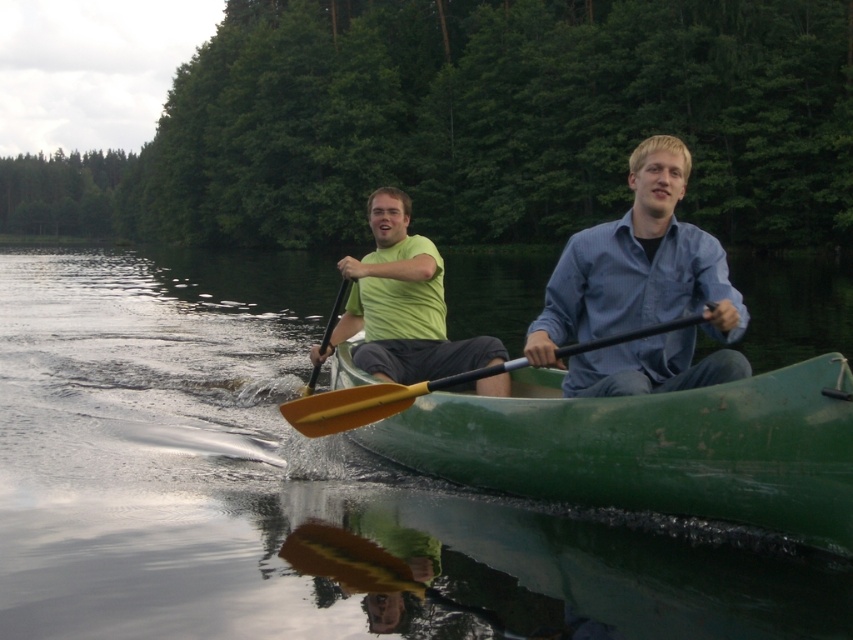
You are a photographer trying to capture the matte green shirt at center and the yellow wood paddle at center in the same frame. Can you see both items at the same time from your current position?

The yellow wood paddle at center is behind the matte green shirt at center, so you cannot see both items at the same time from your current position.

You are an observer standing on the lakeshore, looking at the green matte canoe at center and the matte green shirt at center. Which object appears taller from your viewpoint?

The matte green shirt at center appears taller than the green matte canoe at center because the description states that the green matte canoe at center has a lesser height compared to matte green shirt at center.